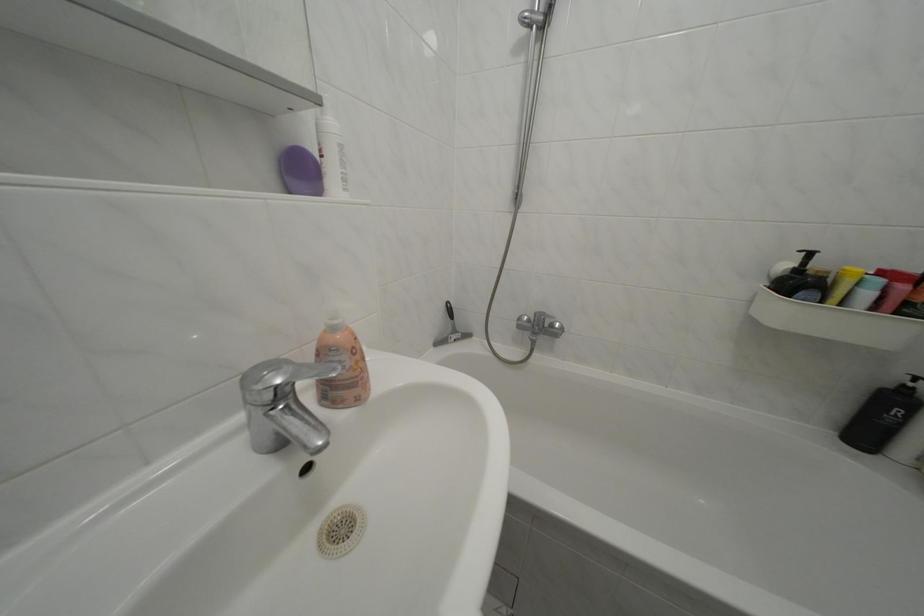
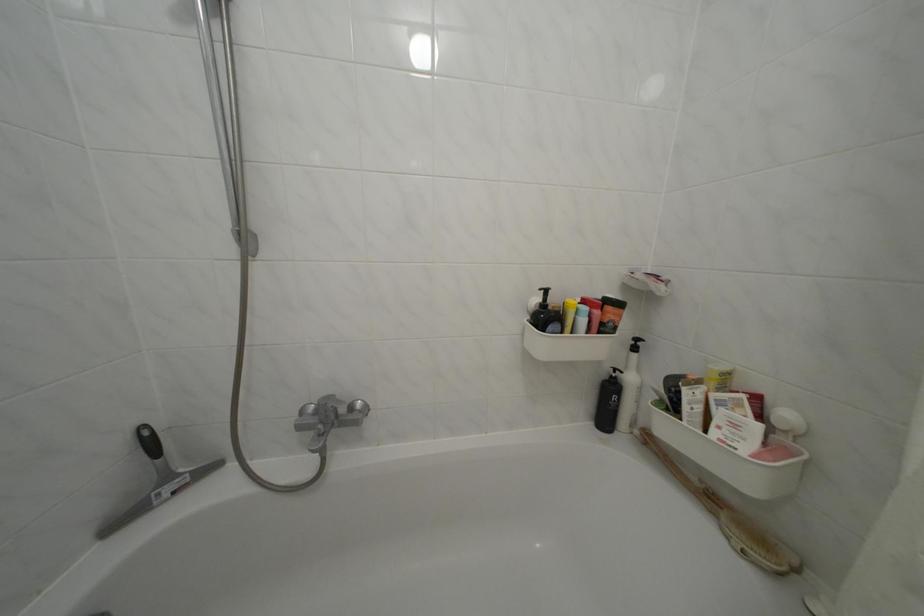
Locate, in the second image, the point that corresponds to [819,278] in the first image.

(560, 314)